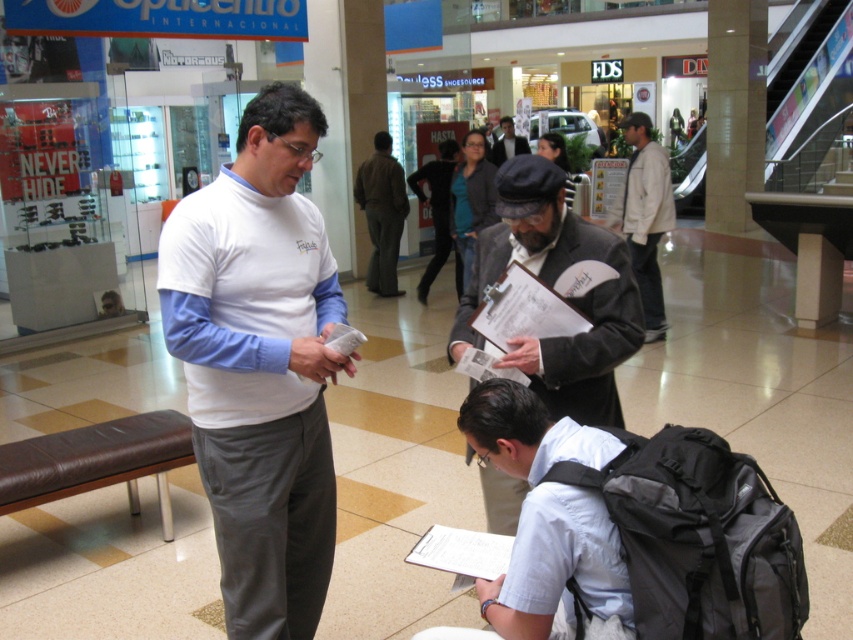
You are a tailor who needs to adjust the length of the dark gray leather jacket at center and the khaki pants at center. Which item requires a hem to be let out to make it longer?

The dark gray leather jacket at center is shorter than khaki pants at center, so the jacket requires a hem to be let out to make it longer.

You are a delivery person who needs to place a small package between the dark gray leather jacket at center and the khaki pants at center. Is there enough space to fit the package?

The dark gray leather jacket at center and khaki pants at center are 5.94 meters apart from each other, so yes, there is enough space to fit the package between them.

You are standing at the point with coordinates point (497, 268) and want to walk to the point with coordinates point (645, 316). Which direction should you move in order to reach your destination?

You should move backward because point (497, 268) is in front of point (645, 316).